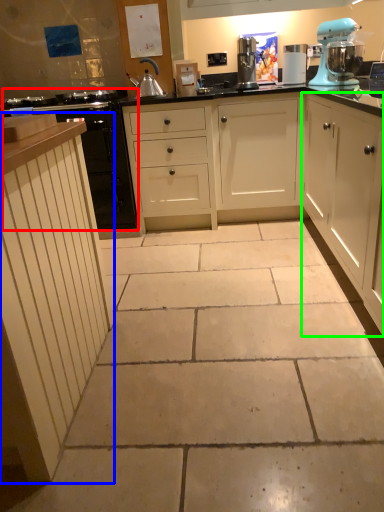
Question: Estimate the real-world distances between objects in this image. Which object is farther from cabinetry (highlighted by a red box), cabinetry (highlighted by a blue box) or cabinetry (highlighted by a green box)?

Choices:
 (A) cabinetry
 (B) cabinetry

Answer: (B)